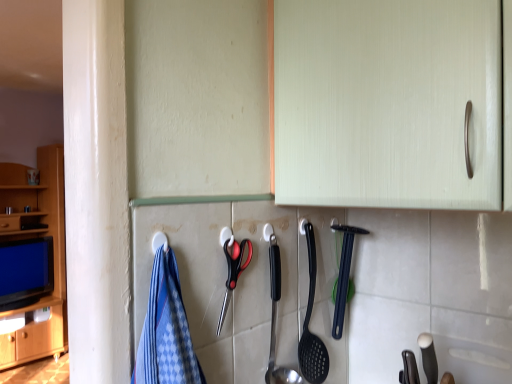
Question: Does satin silver spoon at center, the first silverware from the left, have a greater height compared to black plastic spoon at center, the 1th silverware when ordered from back to front?

Choices:
 (A) no
 (B) yes

Answer: (B)

Question: Does satin silver spoon at center, placed as the second silverware when sorted from right to left, have a larger size compared to black plastic spoon at center, acting as the second silverware starting from the left?

Choices:
 (A) no
 (B) yes

Answer: (B)

Question: Is satin silver spoon at center, positioned as the 2th silverware in back-to-front order, oriented towards black plastic spoon at center, positioned as the second silverware in front-to-back order?

Choices:
 (A) yes
 (B) no

Answer: (B)

Question: From a real-world perspective, is satin silver spoon at center, positioned as the 2th silverware in back-to-front order, positioned under black plastic spoon at center, which ranks as the 1th silverware in right-to-left order, based on gravity?

Choices:
 (A) no
 (B) yes

Answer: (B)

Question: Considering the relative positions of satin silver spoon at center, placed as the second silverware when sorted from right to left, and black plastic spoon at center, positioned as the second silverware in front-to-back order, in the image provided, is satin silver spoon at center, placed as the second silverware when sorted from right to left, to the left of black plastic spoon at center, positioned as the second silverware in front-to-back order, from the viewer's perspective?

Choices:
 (A) yes
 (B) no

Answer: (A)

Question: Is satin silver spoon at center, placed as the second silverware when sorted from right to left, thinner than black plastic spoon at center, acting as the second silverware starting from the left?

Choices:
 (A) yes
 (B) no

Answer: (B)

Question: Considering the relative sizes of black plastic spoon at center, which ranks as the 1th silverware in right-to-left order, and black plastic scissors at center in the image provided, is black plastic spoon at center, which ranks as the 1th silverware in right-to-left order, shorter than black plastic scissors at center?

Choices:
 (A) no
 (B) yes

Answer: (A)

Question: Are black plastic spoon at center, positioned as the second silverware in front-to-back order, and black plastic scissors at center beside each other?

Choices:
 (A) no
 (B) yes

Answer: (A)

Question: Is black plastic spoon at center, positioned as the second silverware in front-to-back order, oriented towards black plastic scissors at center?

Choices:
 (A) no
 (B) yes

Answer: (A)

Question: Is black plastic spoon at center, positioned as the second silverware in front-to-back order, closer to the viewer compared to black plastic scissors at center?

Choices:
 (A) yes
 (B) no

Answer: (B)

Question: Can you confirm if black plastic spoon at center, the 1th silverware when ordered from back to front, is positioned to the right of black plastic scissors at center?

Choices:
 (A) yes
 (B) no

Answer: (A)

Question: From the image's perspective, is black plastic spoon at center, the 1th silverware when ordered from back to front, on black plastic scissors at center?

Choices:
 (A) no
 (B) yes

Answer: (A)

Question: Is satin silver spoon at center, the first silverware from the left, next to black plastic scissors at center?

Choices:
 (A) yes
 (B) no

Answer: (B)